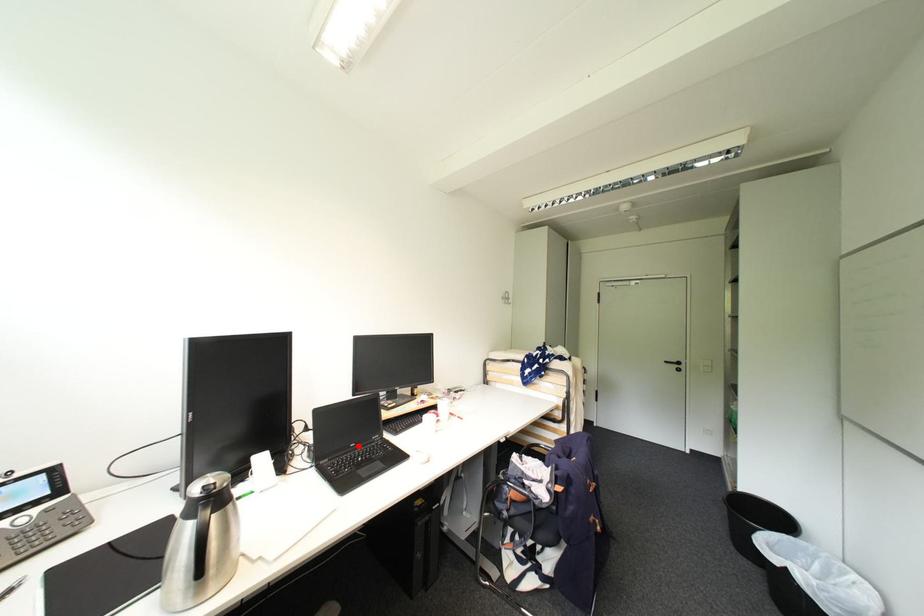
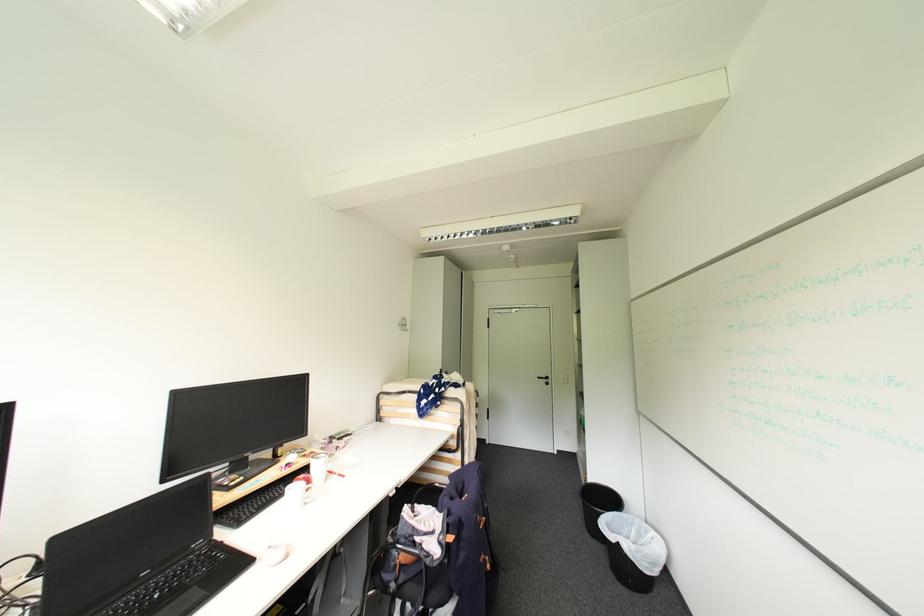
Find the pixel in the second image that matches the highlighted location in the first image.

(150, 575)